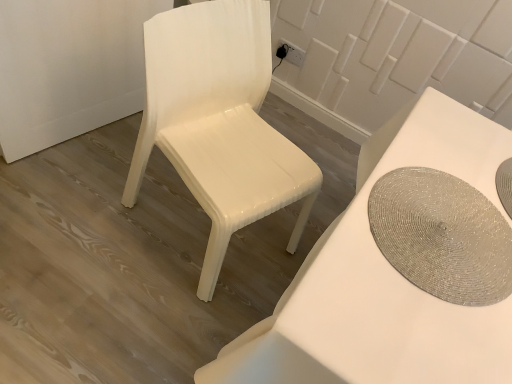
At what (x,y) coordinates should I click in order to perform the action: click on free region on the left part of white glossy chair at left. Please return your answer as a coordinate pair (x, y). Looking at the image, I should click on (84, 204).